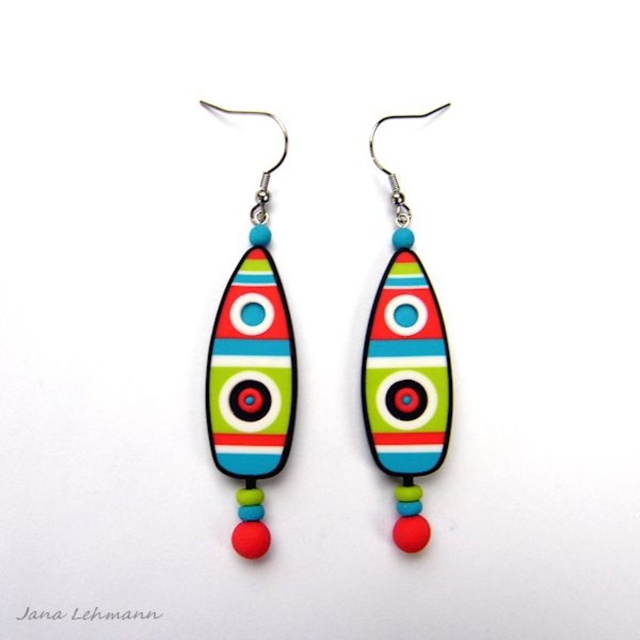
You are an earring designer who wants to place a new earring exactly 0.1 units to the right of the matte plastic earring at left. What coordinate would you use for the new earring?

The matte plastic earring at left is at point (252, 369). Adding 0.1 to the x coordinate gives 0.678, so the new coordinate would be (252, 433).

You are a jewelry designer examining two matte plastic earrings displayed on a white background. You need to determine their height for packaging. Which of the two matte plastic earring at left and matte plastic earring at center is taller?

The matte plastic earring at left is taller than the matte plastic earring at center.

You are a jewelry designer examining two matte plastic earrings. The scene shows a matte plastic earring at left and a matte plastic earring at center. Which one has a larger size?

The matte plastic earring at left is bigger than the matte plastic earring at center.